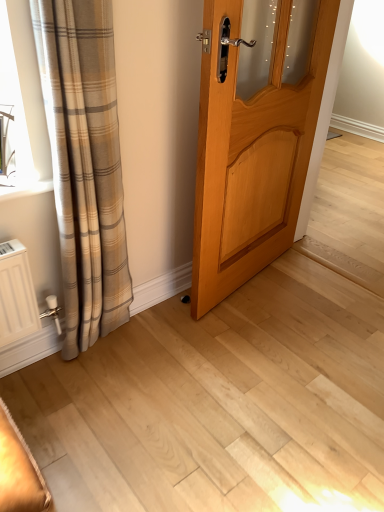
In order to click on vacant area that is in front of plaid fabric curtain at left in this screenshot , I will do `click(87, 400)`.